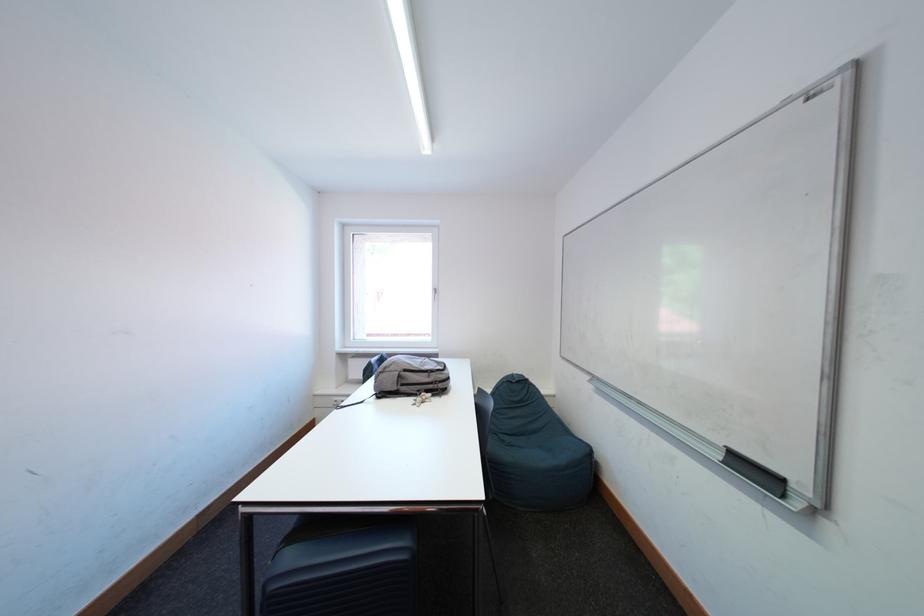
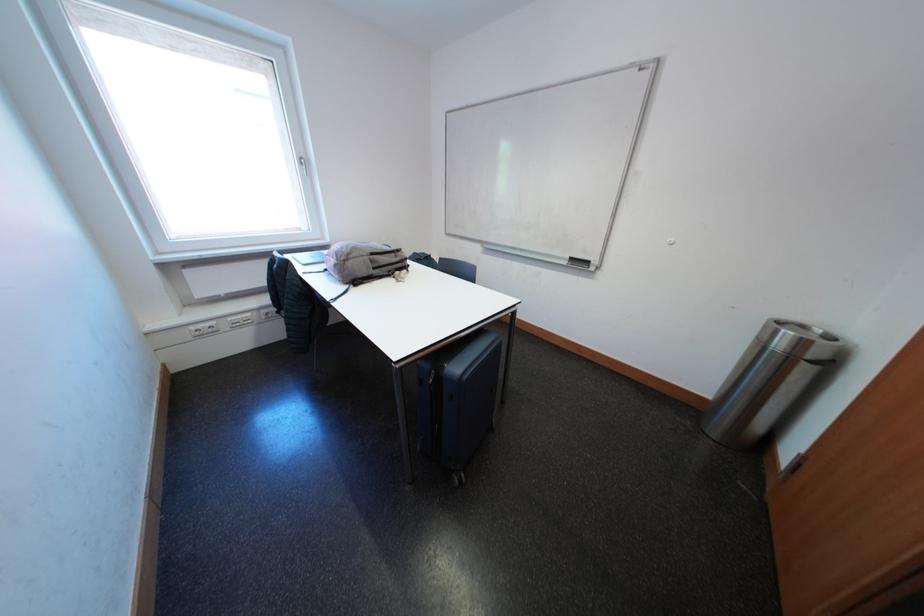
The point at (727,461) is marked in the first image. Where is the corresponding point in the second image?

(575, 267)